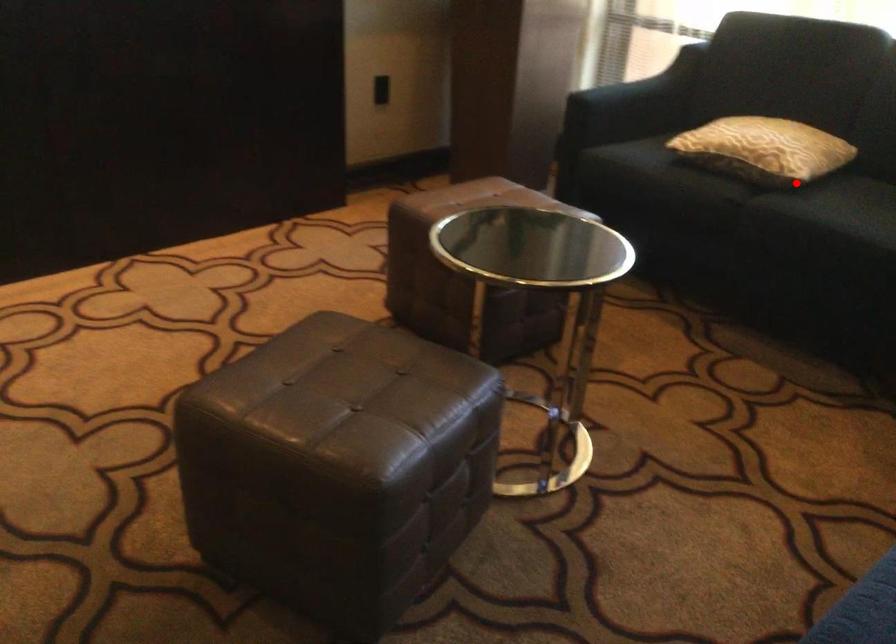
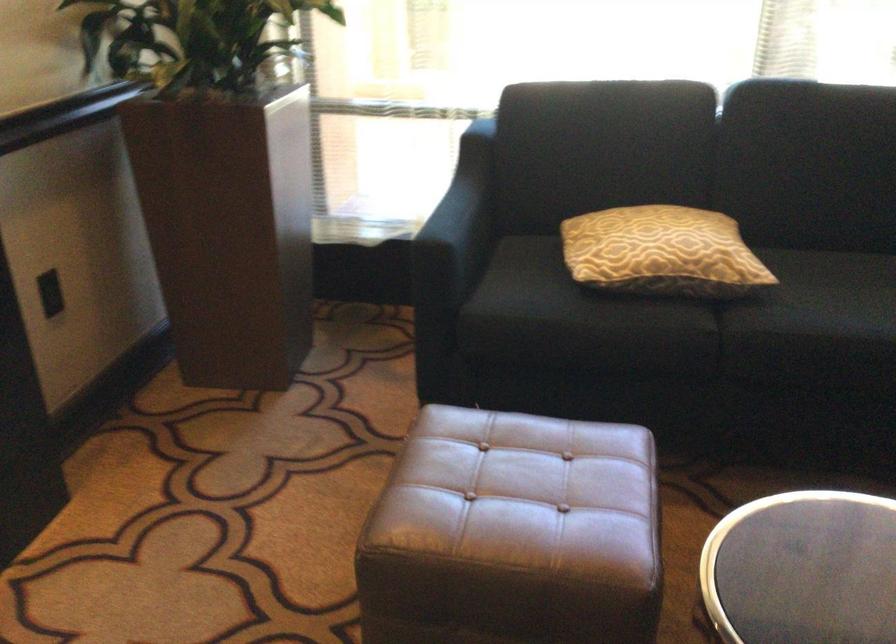
Question: A red point is marked in image1. In image2, is the corresponding 3D point closer to the camera or farther? Reply with the corresponding letter.

Choices:
 (A) The corresponding 3D point is closer.
 (B) The corresponding 3D point is farther.

Answer: (A)